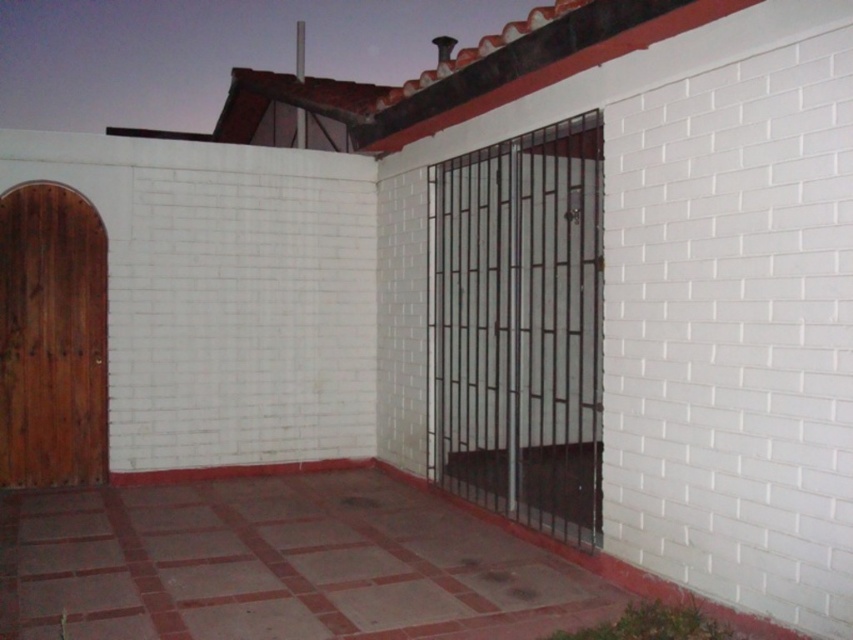
From the picture: You are standing in front of the building and notice two points marked on the ground. The first point is at coordinates point (537, 244) and the second is at point (45, 406). If you were to walk from the first point to the second, would you be moving towards the gate or away from it?

Moving from point (537, 244) to point (45, 406) would be moving away from the gate because point (537, 244) is behind point (45, 406), meaning the first point is closer to the gate.

You are a delivery person approaching the building and need to access the entrance. The path is paved with square tiles leading to the entrance. Which object, the metallic gate at center or the wooden door at left, is closer to the ground?

The wooden door at left is closer to the ground because the metallic gate at center is located above it.

You are a delivery person trying to deliver a package to the wooden door at left. The package is 1.2 meters wide. Can you fit the package through the space next to the metallic gate at center?

The metallic gate at center might be wider than wooden door at left. Since the package is 1.2 meters wide, and the gate could be wider than the door, it is possible that the package can fit through the space next to the metallic gate at center if the gate is wide enough. However, without exact measurements, it is uncertain.